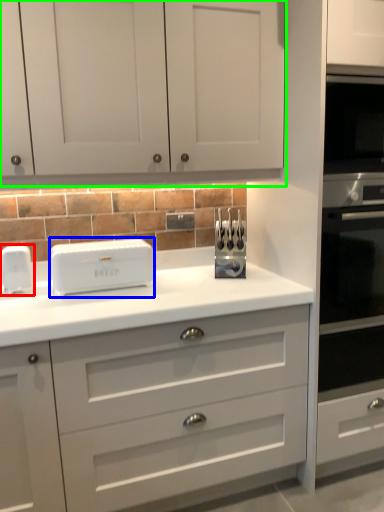
Question: Which object is the farthest from home appliance (highlighted by a red box)? Choose among these: home appliance (highlighted by a blue box) or cabinetry (highlighted by a green box).

Choices:
 (A) home appliance
 (B) cabinetry

Answer: (B)